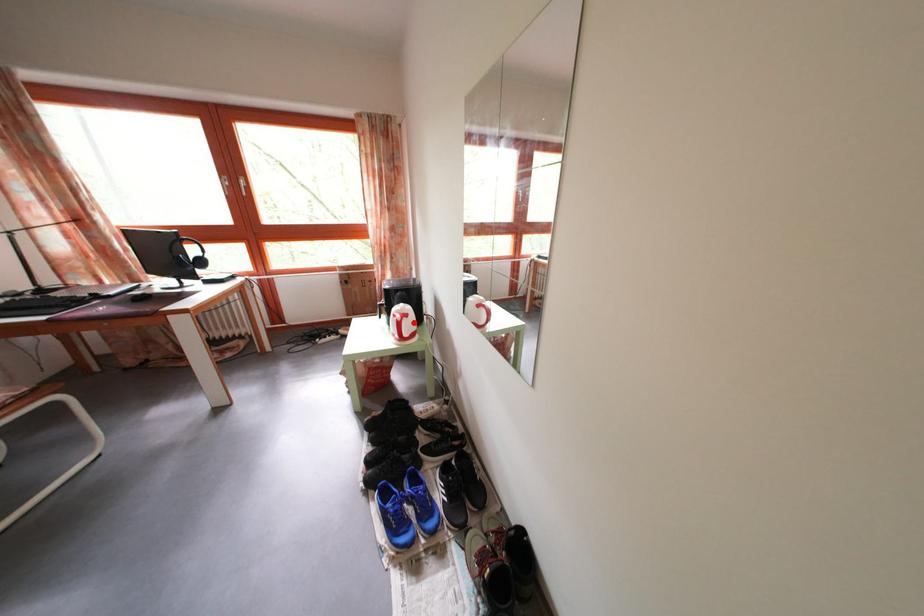
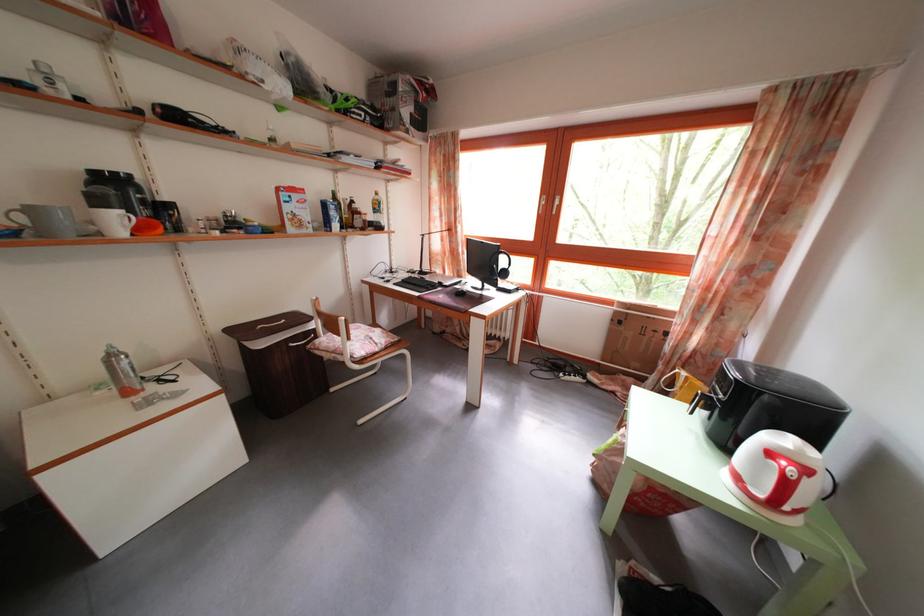
Question: I am providing you with two images of the same scene from different viewpoints. In image1, a red point is highlighted. Considering the same 3D point in image2, which of the following is correct?

Choices:
 (A) It is closer
 (B) It is farther

Answer: (B)